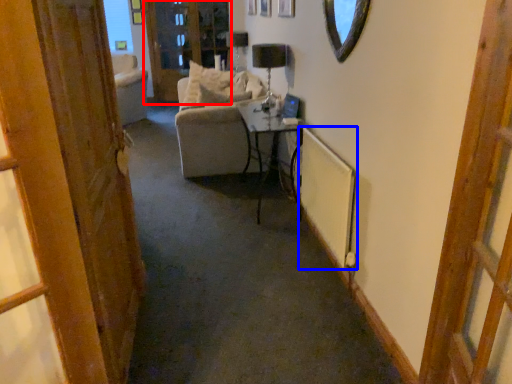
Question: Which object appears farthest to the camera in this image, screen door (highlighted by a red box) or radiator (highlighted by a blue box)?

Choices:
 (A) screen door
 (B) radiator

Answer: (A)